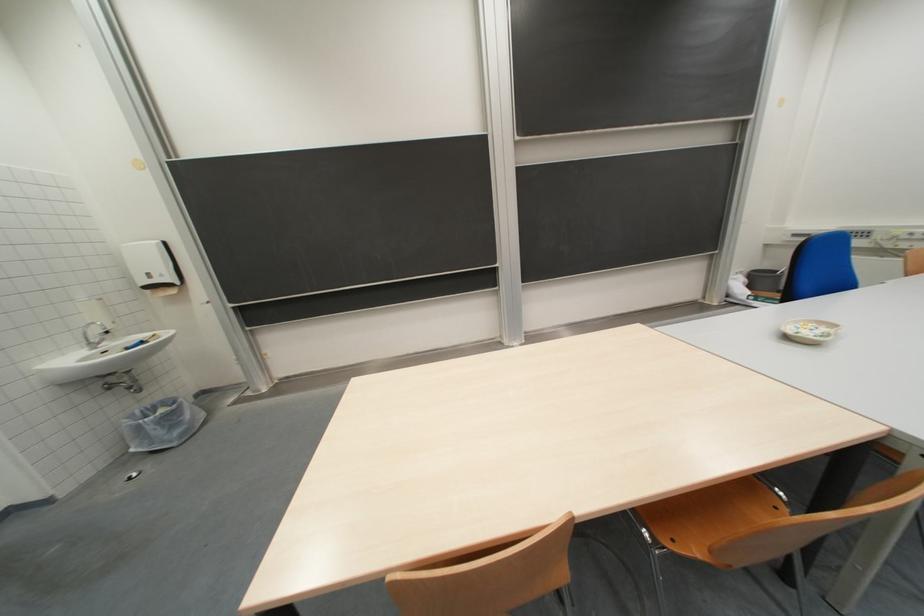
The height and width of the screenshot is (616, 924). Identify the location of faucet handle. point(94,333).